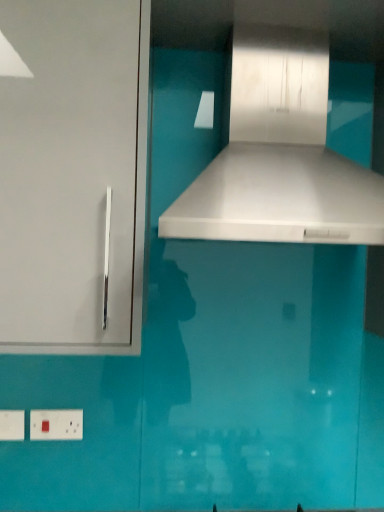
Question: Considering the positions of point (16, 415) and point (377, 176), is point (16, 415) closer or farther from the camera than point (377, 176)?

Choices:
 (A) closer
 (B) farther

Answer: (B)

Question: Considering the positions of white plastic electric outlet at lower left, arranged as the second electric outlet when viewed from the right, and white glossy vent at center in the image, is white plastic electric outlet at lower left, arranged as the second electric outlet when viewed from the right, taller or shorter than white glossy vent at center?

Choices:
 (A) tall
 (B) short

Answer: (B)

Question: Estimate the real-world distances between objects in this image. Which object is closer to the white plastic electric outlet at lower left, the second electric outlet in the left-to-right sequence?

Choices:
 (A) white plastic electric outlet at lower left, the first electric outlet viewed from the left
 (B) white glossy cabinet handle at left
 (C) white glossy vent at center

Answer: (A)

Question: Which object is the farthest from the white glossy cabinet handle at left?

Choices:
 (A) white plastic electric outlet at lower left, the first electric outlet from the right
 (B) white plastic electric outlet at lower left, the first electric outlet viewed from the left
 (C) white glossy vent at center

Answer: (B)